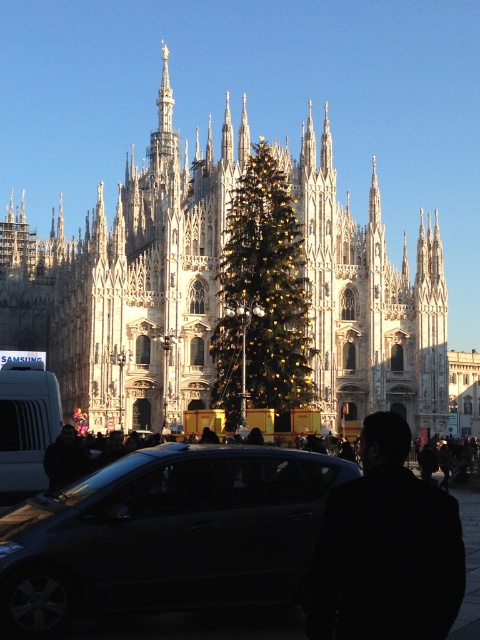
You are a photographer planning to take a photo of the cathedral. You notice the black wool coat at center and the matte silver van at left in the background. Which object should you adjust your camera focus to capture clearly if you want to emphasize the foreground subject?

The black wool coat at center should be focused on since it is closer to the camera than the matte silver van at left, making it the foreground subject.

You are standing in front of the cathedral and want to take a photo of both the point at coordinates point (162, 260) and the point at coordinates point (323, 548). Since you want to include both points in the frame, which point should you position closer to the camera to ensure both are visible?

Since point (162, 260) is behind point (323, 548), you should position the camera closer to point (323, 548) so that both points can be captured in the frame without one blocking the other.